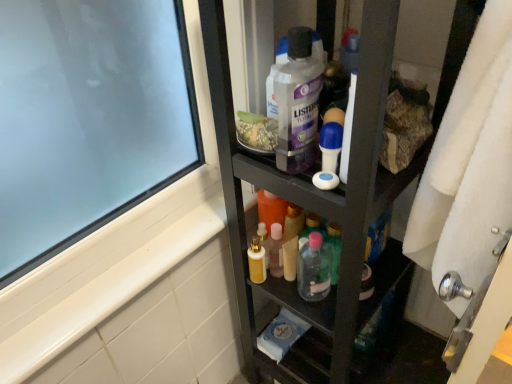
Question: Can you confirm if clear plastic mouthwash at center is thinner than white fluffy bath towel at right?

Choices:
 (A) no
 (B) yes

Answer: (A)

Question: Is clear plastic mouthwash at center bigger than white fluffy bath towel at right?

Choices:
 (A) no
 (B) yes

Answer: (A)

Question: From a real-world perspective, is clear plastic mouthwash at center physically above white fluffy bath towel at right?

Choices:
 (A) no
 (B) yes

Answer: (B)

Question: Considering the relative sizes of clear plastic mouthwash at center and white fluffy bath towel at right in the image provided, is clear plastic mouthwash at center taller than white fluffy bath towel at right?

Choices:
 (A) yes
 (B) no

Answer: (B)

Question: Is clear plastic mouthwash at center at the left side of white fluffy bath towel at right?

Choices:
 (A) no
 (B) yes

Answer: (B)

Question: From the image's perspective, is white matte soap at center above or below white plastic roll-on deodorant at center, which appears as the 1th toiletry when viewed from the top?

Choices:
 (A) below
 (B) above

Answer: (A)

Question: Based on their positions, is white matte soap at center located to the left or right of white plastic roll-on deodorant at center, which appears as the 1th toiletry when viewed from the top?

Choices:
 (A) left
 (B) right

Answer: (A)

Question: Considering their positions, is white matte soap at center located in front of or behind white plastic roll-on deodorant at center, the first toiletry viewed from the front?

Choices:
 (A) behind
 (B) front

Answer: (A)

Question: From a real-world perspective, is white matte soap at center positioned above or below white plastic roll-on deodorant at center, the first toiletry viewed from the front?

Choices:
 (A) below
 (B) above

Answer: (A)

Question: Looking at their shapes, would you say clear plastic mouthwash at center is wider or thinner than translucent plastic bottle at center, the second toiletry viewed from the front?

Choices:
 (A) thin
 (B) wide

Answer: (B)

Question: Considering the relative positions of clear plastic mouthwash at center and translucent plastic bottle at center, the second toiletry viewed from the front, in the image provided, is clear plastic mouthwash at center to the left or to the right of translucent plastic bottle at center, the second toiletry viewed from the front,?

Choices:
 (A) left
 (B) right

Answer: (A)

Question: Relative to translucent plastic bottle at center, the first toiletry positioned from the bottom, is clear plastic mouthwash at center in front or behind?

Choices:
 (A) behind
 (B) front

Answer: (B)

Question: Is clear plastic mouthwash at center spatially inside translucent plastic bottle at center, which appears as the second toiletry when viewed from the top, or outside of it?

Choices:
 (A) inside
 (B) outside

Answer: (B)

Question: Is point click(412, 220) positioned closer to the camera than point click(244, 246)?

Choices:
 (A) closer
 (B) farther

Answer: (A)

Question: Is white fluffy bath towel at right in front of or behind black matte cabinet at center in the image?

Choices:
 (A) behind
 (B) front

Answer: (B)